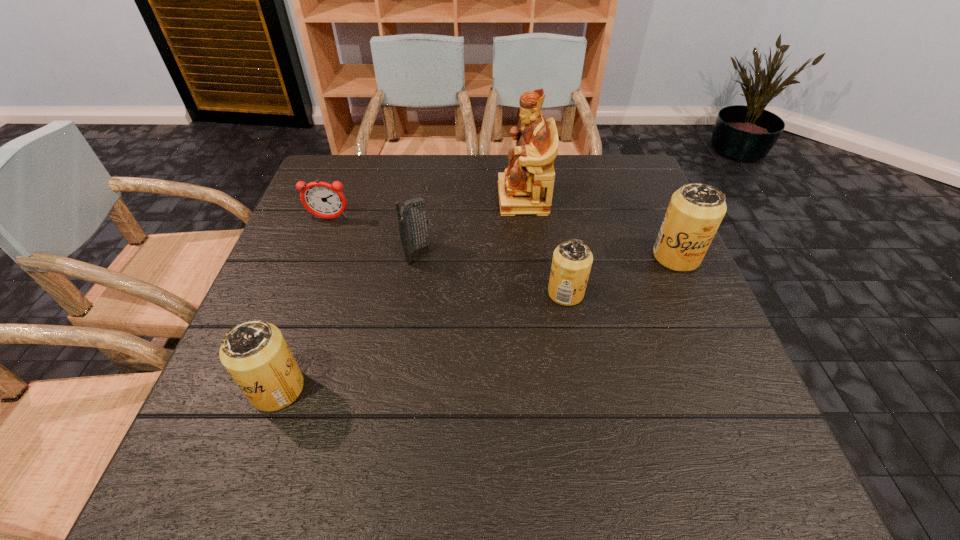
Find the location of `free point between the third object from left to right and the second beer can from left to right`. free point between the third object from left to right and the second beer can from left to right is located at coordinates (492, 273).

Where is `vacant area between the second nearest object and the leftmost beer can`? Image resolution: width=960 pixels, height=540 pixels. vacant area between the second nearest object and the leftmost beer can is located at coordinates (421, 341).

Where is `vacant space that is in between the alarm clock and the second beer can from right to left`? vacant space that is in between the alarm clock and the second beer can from right to left is located at coordinates (447, 256).

This screenshot has width=960, height=540. Identify the location of vacant area between the nearest object and the farthest beer can. (477, 322).

You are a GUI agent. You are given a task and a screenshot of the screen. Output one action in this format:
    pyautogui.click(x=<x>, y=<y>)
    Task: Click on the empty location between the tallest object and the cellular telephone
    The height and width of the screenshot is (540, 960).
    Given the screenshot: What is the action you would take?
    pyautogui.click(x=470, y=226)

At what (x,y) coordinates should I click in order to perform the action: click on empty space between the second nearest beer can and the nearest beer can. Please return your answer as a coordinate pair (x, y). Looking at the image, I should click on (421, 341).

Find the location of a particular element. The image size is (960, 540). free space between the farthest beer can and the second nearest beer can is located at coordinates (621, 274).

Where is `vacant area that lies between the cellular telephone and the tallest object`? The width and height of the screenshot is (960, 540). vacant area that lies between the cellular telephone and the tallest object is located at coordinates (470, 226).

Identify the location of free space between the shortest beer can and the cellular telephone. The width and height of the screenshot is (960, 540). (492, 273).

Find the location of a particular element. The image size is (960, 540). object that is the fifth closest to the alarm clock is located at coordinates (695, 211).